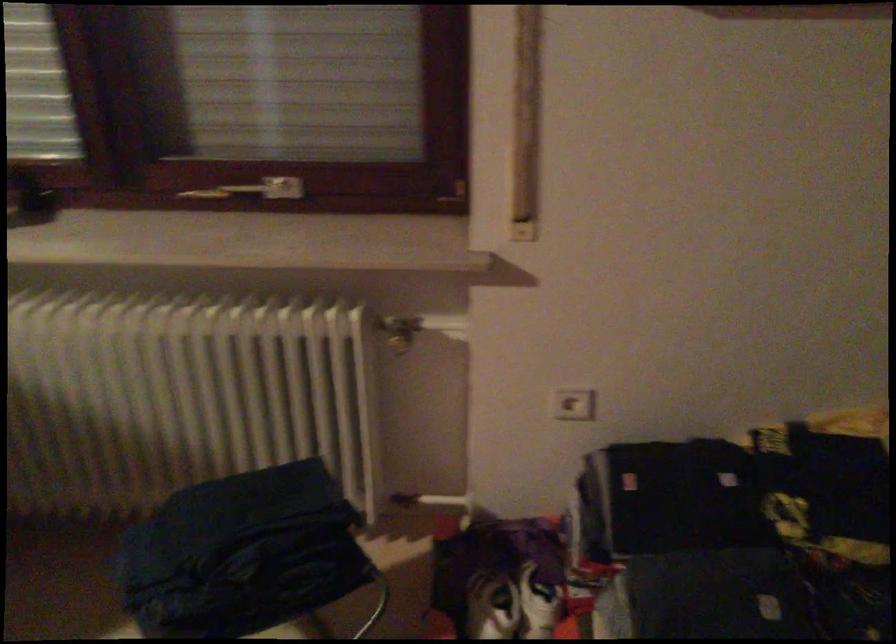
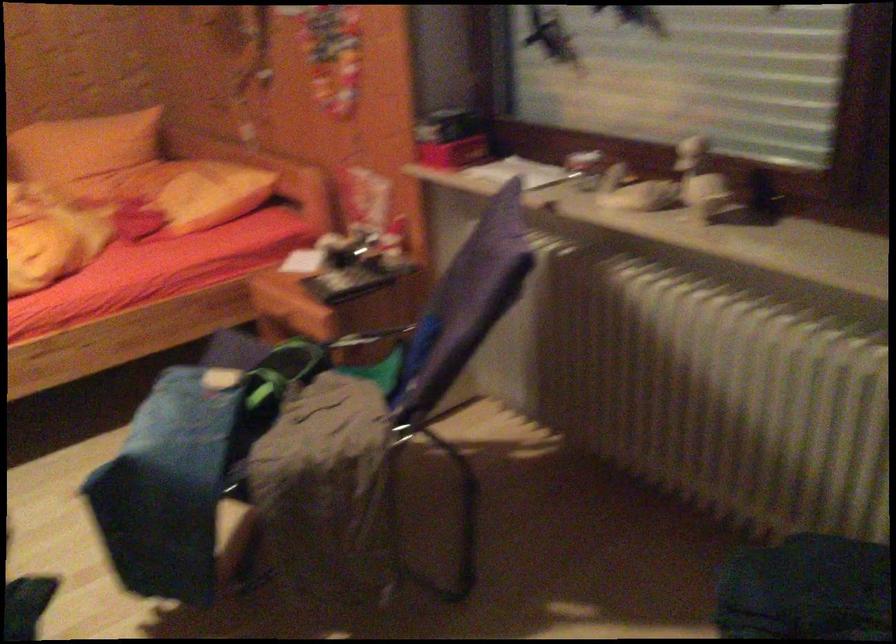
Question: The first image is from the beginning of the video and the second image is from the end. How did the camera likely rotate when shooting the video?

Choices:
 (A) Left
 (B) Right
 (C) Up
 (D) Down

Answer: (A)